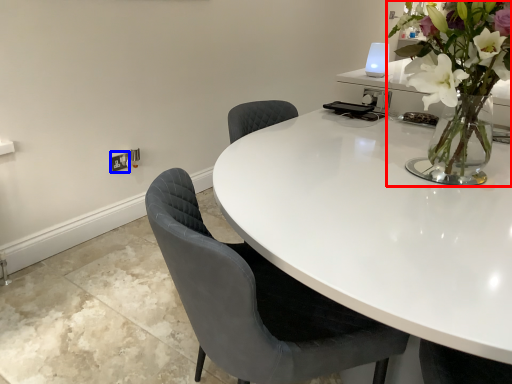
Question: Which object is further to the camera taking this photo, houseplant (highlighted by a red box) or electric outlet (highlighted by a blue box)?

Choices:
 (A) houseplant
 (B) electric outlet

Answer: (B)